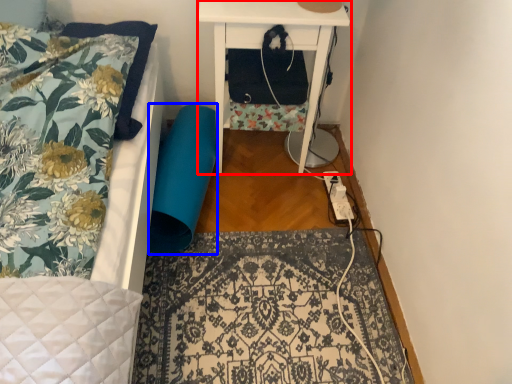
Question: Among these objects, which one is farthest to the camera, nightstand (highlighted by a red box) or swivel chair (highlighted by a blue box)?

Choices:
 (A) nightstand
 (B) swivel chair

Answer: (B)